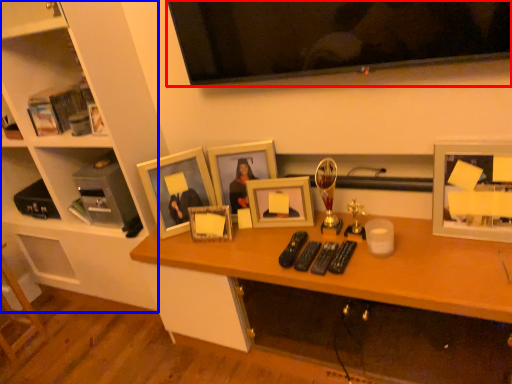
Question: Which object is further to the camera taking this photo, television (highlighted by a red box) or furniture (highlighted by a blue box)?

Choices:
 (A) television
 (B) furniture

Answer: (B)